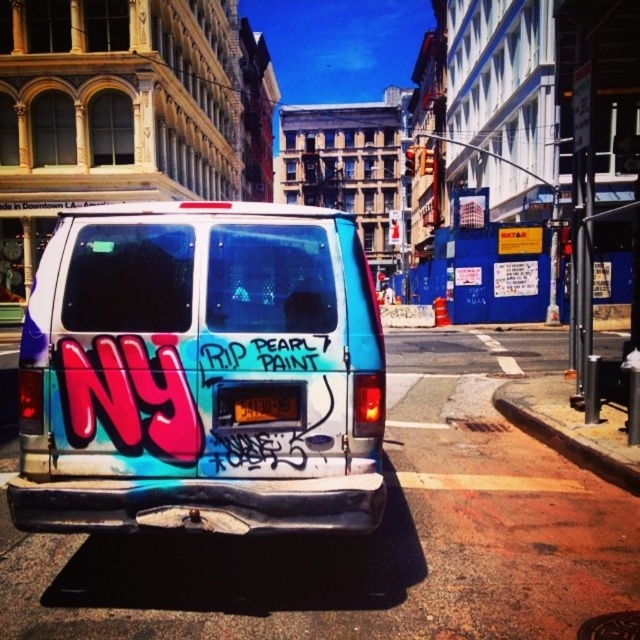
Question: Can you confirm if white matte text at center is positioned to the right of brown concrete curb at lower right?

Choices:
 (A) no
 (B) yes

Answer: (A)

Question: Does white matte text at center lie behind black plastic license plate at rear center?

Choices:
 (A) yes
 (B) no

Answer: (B)

Question: Estimate the real-world distances between objects in this image. Which object is closer to the white matte text at center?

Choices:
 (A) brown concrete curb at lower right
 (B) black plastic license plate at rear center
 (C) matte graffiti van at center

Answer: (B)

Question: Among these points, which one is farthest from the camera?

Choices:
 (A) (164, 356)
 (B) (308, 356)

Answer: (B)

Question: Which of these objects is positioned farthest from the brown concrete curb at lower right?

Choices:
 (A) black plastic license plate at rear center
 (B) matte graffiti van at center

Answer: (B)

Question: In this image, where is matte graffiti van at center located relative to brown concrete curb at lower right?

Choices:
 (A) above
 (B) below

Answer: (A)